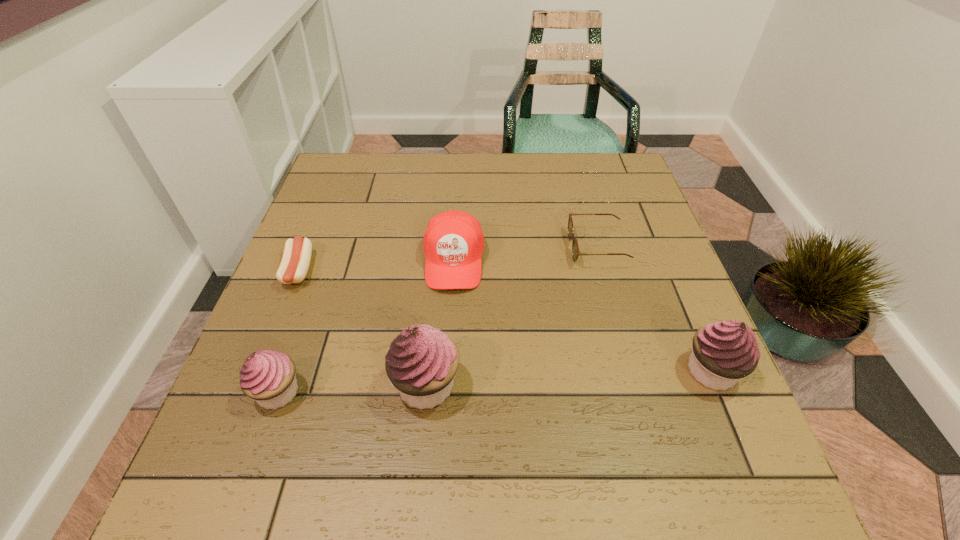
Find the location of a particular element. unoccupied position between the fourth tallest object and the sausage is located at coordinates (376, 266).

What are the coordinates of `vacant area that lies between the third shortest object and the second cupcake from left to right` in the screenshot? It's located at (440, 323).

You are a GUI agent. You are given a task and a screenshot of the screen. Output one action in this format:
    pyautogui.click(x=<x>, y=<y>)
    Task: Click on the free space between the baseball cap and the shortest cupcake
    The image size is (960, 540).
    Given the screenshot: What is the action you would take?
    pyautogui.click(x=366, y=326)

Locate an element on the screen. Image resolution: width=960 pixels, height=540 pixels. empty space between the sausage and the baseball cap is located at coordinates (376, 266).

You are a GUI agent. You are given a task and a screenshot of the screen. Output one action in this format:
    pyautogui.click(x=<x>, y=<y>)
    Task: Click on the free space between the second tallest object and the spectacles
    This screenshot has width=960, height=540.
    Given the screenshot: What is the action you would take?
    pyautogui.click(x=654, y=309)

Where is `empty space between the shortest cupcake and the third shortest object`? The height and width of the screenshot is (540, 960). empty space between the shortest cupcake and the third shortest object is located at coordinates (366, 326).

I want to click on empty space that is in between the second cupcake from right to left and the shortest cupcake, so click(x=352, y=388).

Identify which object is located as the nearest to the second cupcake from right to left. Please provide its 2D coordinates. Your answer should be formatted as a tuple, i.e. [(x, y)], where the tuple contains the x and y coordinates of a point satisfying the conditions above.

[(268, 376)]

Locate an element on the screen. The image size is (960, 540). object that is the third nearest to the second shortest cupcake is located at coordinates (422, 361).

Point out which cupcake is positioned as the third nearest to the third shortest object. Please provide its 2D coordinates. Your answer should be formatted as a tuple, i.e. [(x, y)], where the tuple contains the x and y coordinates of a point satisfying the conditions above.

[(724, 352)]